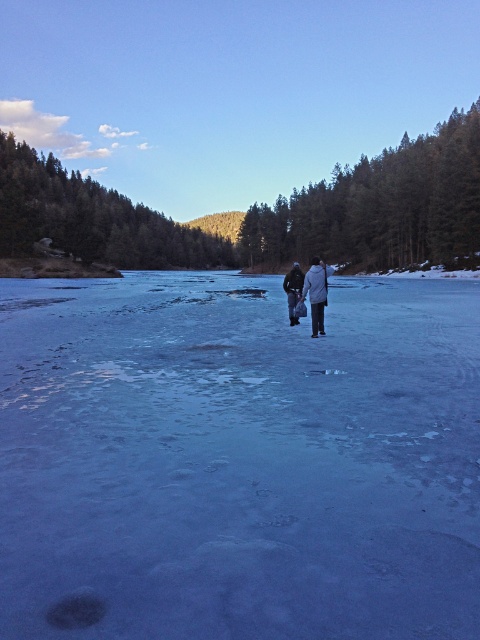
You are standing at the origin point of the coordinate system in the winter landscape. The white woolen coat at center is at coordinates 0.456, 0.660. If you want to walk directly towards the coat, in which general direction should you move?

You should move in the direction of the coordinates (316, 291), which is towards the white woolen coat at center. Since the coat is at those coordinates, moving towards those coordinates would be the correct direction.

You are an observer standing at the edge of the frozen lake. You notice the blue ice at center and the dark gray jacket at center. Which object takes up more space in the scene?

The blue ice at center is larger in size than the dark gray jacket at center, so the blue ice takes up more space in the scene.